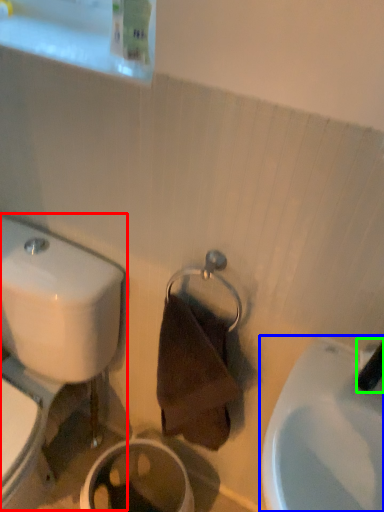
Question: Based on their relative distances, which object is nearer to toilet (highlighted by a red box)? Choose from sink (highlighted by a blue box) and plumbing fixture (highlighted by a green box).

Choices:
 (A) sink
 (B) plumbing fixture

Answer: (A)